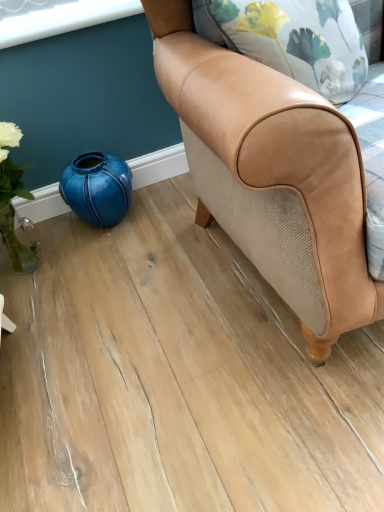
Locate an element on the screen. The image size is (384, 512). vacant space to the right of teal glossy vase at lower left is located at coordinates coord(171,207).